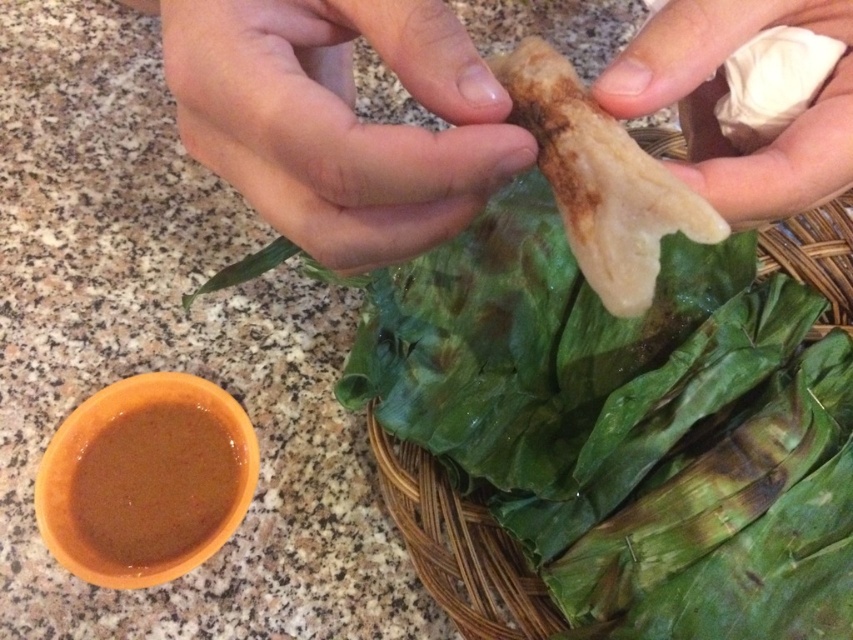
Question: Does smooth skin hand at upper center appear over white matte pastry at center?

Choices:
 (A) yes
 (B) no

Answer: (A)

Question: From the image, what is the correct spatial relationship of smooth skin hand at upper center in relation to brown matte sauce at lower left?

Choices:
 (A) above
 (B) below

Answer: (A)

Question: Considering the real-world distances, which object is farthest from the white matte paper towel at upper right?

Choices:
 (A) smooth skin hand at upper center
 (B) white matte pastry at center
 (C) brown matte sauce at lower left

Answer: (C)

Question: Is smooth skin hand at upper center closer to the viewer compared to white matte paper towel at upper right?

Choices:
 (A) yes
 (B) no

Answer: (A)

Question: Which object is closer to the camera taking this photo?

Choices:
 (A) brown matte sauce at lower left
 (B) white matte pastry at center
 (C) white matte paper towel at upper right
 (D) green leafy at upper center

Answer: (B)

Question: Which of the following is the closest to the observer?

Choices:
 (A) (697, 29)
 (B) (384, 436)

Answer: (A)